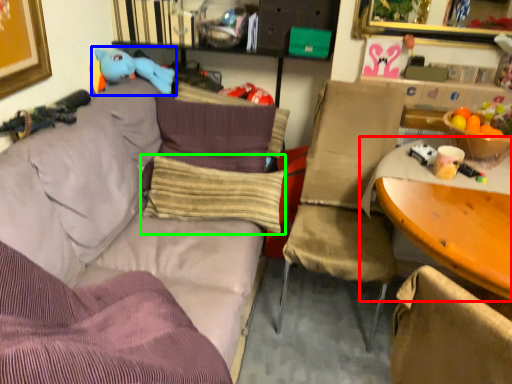
Question: Which is nearer to the table (highlighted by a red box)? toy (highlighted by a blue box) or pillow (highlighted by a green box).

Choices:
 (A) toy
 (B) pillow

Answer: (B)